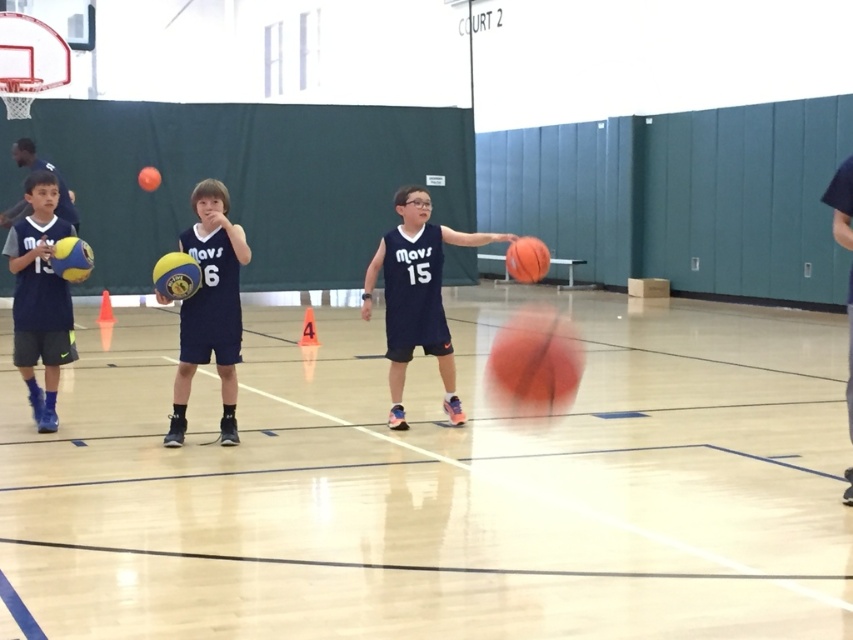
Question: Which object is positioned closest to the matte yellow basketball at left?

Choices:
 (A) rubber basketball at center
 (B) rubber textured basketball at center

Answer: (A)

Question: Which of these objects is positioned farthest from the rubber basketball at center?

Choices:
 (A) rubber/synthetic basketball at center
 (B) rubber basketball at upper center

Answer: (B)

Question: Estimate the real-world distances between objects in this image. Which object is farther from the matte blue jersey at center?

Choices:
 (A) glossy blue jersey at center
 (B) matte yellow basketball at left
 (C) rubber basketball at center

Answer: (A)

Question: Does rubber basketball at center have a lesser width compared to glossy blue jersey at center?

Choices:
 (A) no
 (B) yes

Answer: (B)

Question: Is matte yellow basketball at left wider than rubber textured basketball at center?

Choices:
 (A) yes
 (B) no

Answer: (A)

Question: Can you confirm if rubber basketball at center is positioned to the right of matte yellow basketball at left?

Choices:
 (A) no
 (B) yes

Answer: (B)